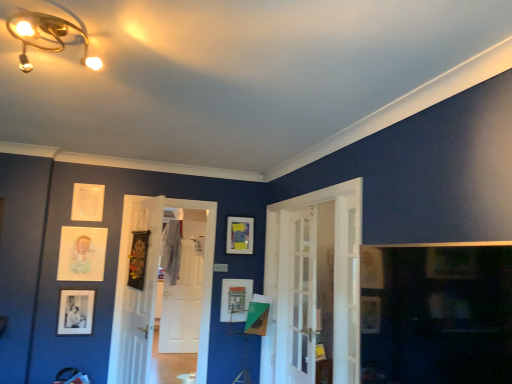
Question: Does wooden textured picture frame at center, the third picture frame from the left, have a lesser height compared to clear glass screen door at center?

Choices:
 (A) yes
 (B) no

Answer: (A)

Question: Considering the relative sizes of wooden textured picture frame at center, which is counted as the 3th picture frame, starting from the right, and clear glass screen door at center in the image provided, is wooden textured picture frame at center, which is counted as the 3th picture frame, starting from the right, wider than clear glass screen door at center?

Choices:
 (A) no
 (B) yes

Answer: (B)

Question: Could clear glass screen door at center be considered to be inside wooden textured picture frame at center, the third picture frame from the left?

Choices:
 (A) no
 (B) yes

Answer: (A)

Question: Does wooden textured picture frame at center, the third picture frame from the left, turn towards clear glass screen door at center?

Choices:
 (A) no
 (B) yes

Answer: (A)

Question: Is wooden textured picture frame at center, the third picture frame from the left, taller than clear glass screen door at center?

Choices:
 (A) yes
 (B) no

Answer: (B)

Question: Which is correct: matte white picture frame at center, which is counted as the 4th picture frame, starting from the left, is inside wooden textured picture frame at center, which is counted as the 3th picture frame, starting from the right, or outside of it?

Choices:
 (A) inside
 (B) outside

Answer: (B)

Question: From a real-world perspective, is matte white picture frame at center, which is counted as the 4th picture frame, starting from the left, positioned above or below wooden textured picture frame at center, the third picture frame from the left?

Choices:
 (A) above
 (B) below

Answer: (B)

Question: Considering the positions of point pos(221,317) and point pos(140,243), is point pos(221,317) closer or farther from the camera than point pos(140,243)?

Choices:
 (A) farther
 (B) closer

Answer: (A)

Question: Looking at the image, does matte white picture frame at center, which is counted as the 4th picture frame, starting from the left, seem bigger or smaller compared to wooden textured picture frame at center, which is counted as the 3th picture frame, starting from the right?

Choices:
 (A) big
 (B) small

Answer: (B)

Question: Is point (229, 317) positioned closer to the camera than point (352, 365)?

Choices:
 (A) closer
 (B) farther

Answer: (B)

Question: Which is correct: matte white picture frame at center, arranged as the 2th picture frame when viewed from the right, is inside white glass door at center, which is counted as the 3th door, starting from the left, or outside of it?

Choices:
 (A) outside
 (B) inside

Answer: (A)

Question: From the image's perspective, is matte white picture frame at center, which is counted as the 4th picture frame, starting from the left, located above or below white glass door at center, which is counted as the 3th door, starting from the left?

Choices:
 (A) above
 (B) below

Answer: (B)

Question: Based on their positions, is matte white picture frame at center, which is counted as the 4th picture frame, starting from the left, located to the left or right of white glass door at center, the 1th door from the right?

Choices:
 (A) left
 (B) right

Answer: (A)

Question: From a real-world perspective, is matte white picture frame at center, arranged as the 2th picture frame when viewed from the right, above or below matte paper picture frame at upper left, which is counted as the 2th picture frame, starting from the left?

Choices:
 (A) above
 (B) below

Answer: (B)

Question: In terms of size, does matte white picture frame at center, which is counted as the 4th picture frame, starting from the left, appear bigger or smaller than matte paper picture frame at upper left, arranged as the fourth picture frame when viewed from the right?

Choices:
 (A) small
 (B) big

Answer: (B)